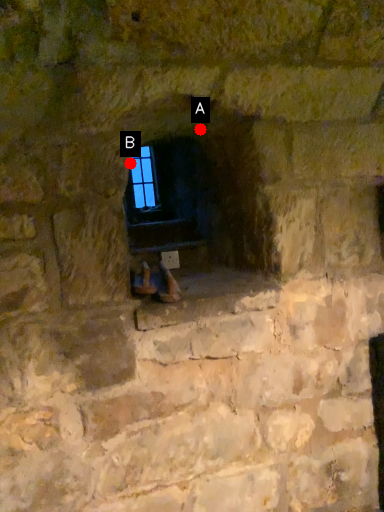
Question: Two points are circled on the image, labeled by A and B beside each circle. Which of the following is the farthest from the observer?

Choices:
 (A) A is further
 (B) B is further

Answer: (B)